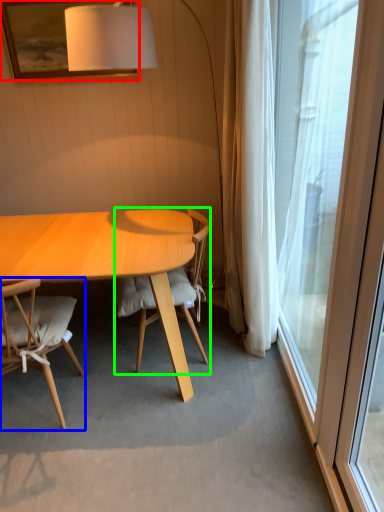
Question: Which object is positioned closest to picture frame (highlighted by a red box)? Select from chair (highlighted by a blue box) and chair (highlighted by a green box).

Choices:
 (A) chair
 (B) chair

Answer: (B)